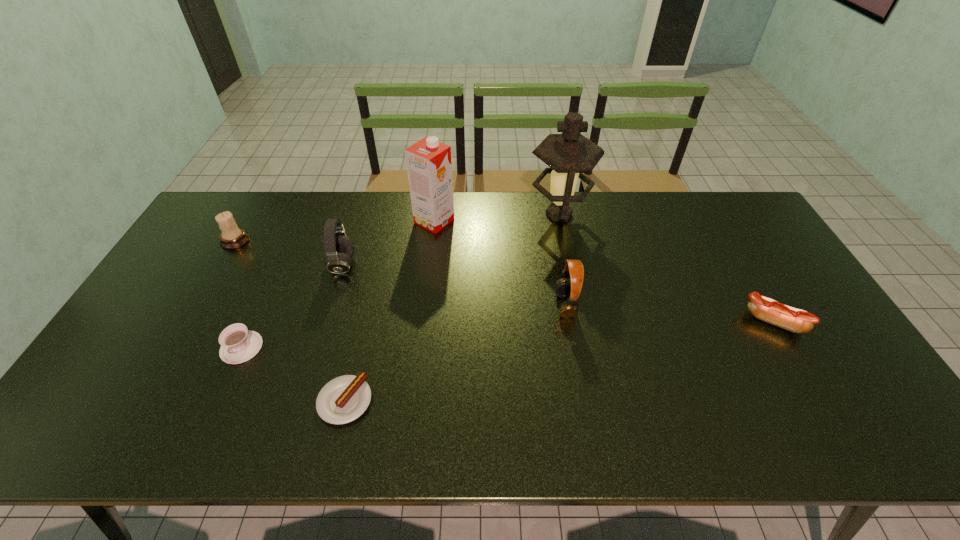
Find the location of `the second object from left to right`. the second object from left to right is located at coordinates (238, 344).

The image size is (960, 540). In order to click on teacup in this screenshot , I will do `click(238, 344)`.

Locate an element on the screen. the left sausage is located at coordinates (342, 400).

What are the coordinates of `the nearer sausage` in the screenshot? It's located at (342, 400).

Where is `vacant point located 0.370m on the front of the oil lamp`? The width and height of the screenshot is (960, 540). vacant point located 0.370m on the front of the oil lamp is located at coordinates (580, 319).

Find the location of a particular element. vacant space located 0.240m on the right of the carton is located at coordinates (524, 221).

The height and width of the screenshot is (540, 960). I want to click on vacant point located 0.170m on the ear cups of the farther headset, so click(411, 265).

I want to click on blank area located on the ear cups of the right headset, so click(x=446, y=305).

You are a GUI agent. You are given a task and a screenshot of the screen. Output one action in this format:
    pyautogui.click(x=<x>, y=<y>)
    Task: Click on the vacant point located on the ear cups of the right headset
    The height and width of the screenshot is (540, 960).
    Given the screenshot: What is the action you would take?
    pyautogui.click(x=538, y=305)

Where is `vacant position located 0.230m on the ear cups of the right headset`? vacant position located 0.230m on the ear cups of the right headset is located at coordinates (475, 305).